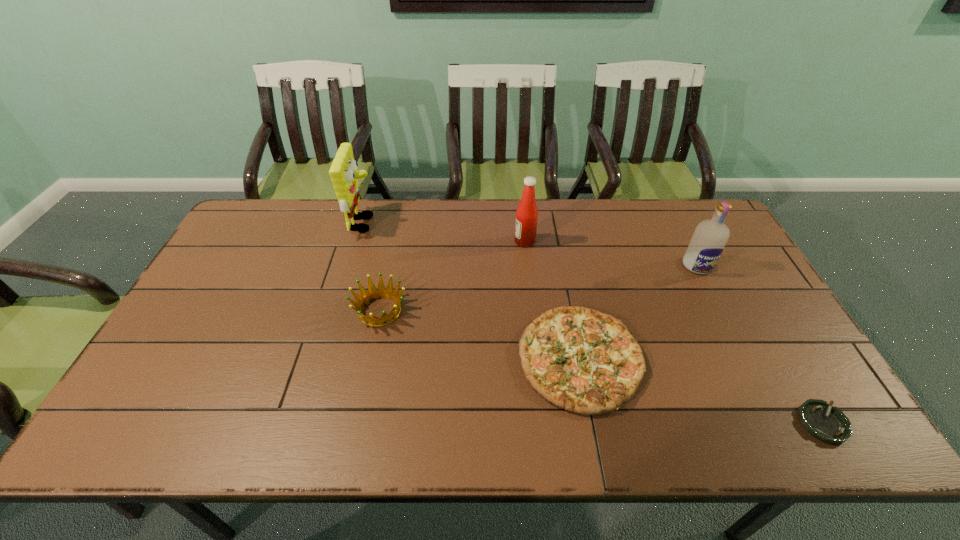
Image resolution: width=960 pixels, height=540 pixels. Find the location of `vacant region that satisfies the following two spatial constraints: 1. on the face of the shortest object; 2. on the right side of the sponge`. vacant region that satisfies the following two spatial constraints: 1. on the face of the shortest object; 2. on the right side of the sponge is located at coordinates (305, 423).

The height and width of the screenshot is (540, 960). In order to click on free spot that satisfies the following two spatial constraints: 1. on the front-facing side of the condiment; 2. on the back side of the shortest object in this screenshot , I will do `click(544, 423)`.

The image size is (960, 540). I want to click on free region that satisfies the following two spatial constraints: 1. on the face of the sponge; 2. on the back side of the fifth tallest object, so click(324, 359).

Identify the location of vacant region that satisfies the following two spatial constraints: 1. on the front-facing side of the condiment; 2. on the back side of the pizza. This screenshot has height=540, width=960. (538, 359).